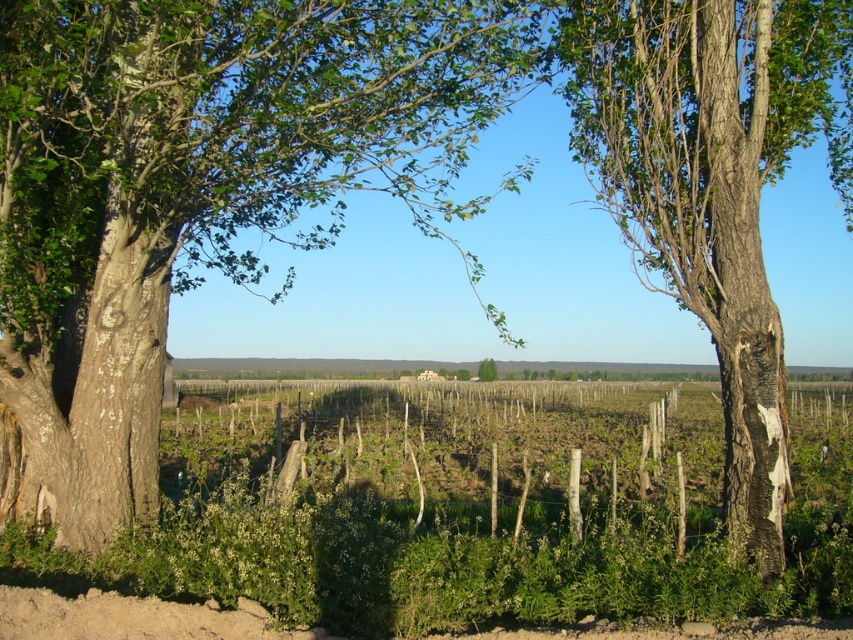
Question: Which object is the closest to the smooth bark tree at right?

Choices:
 (A) green leafy tree at center
 (B) green leafy vines at center

Answer: (B)

Question: Is the position of green leafy vines at center more distant than that of smooth bark tree at right?

Choices:
 (A) no
 (B) yes

Answer: (A)

Question: Which point is closer to the camera?

Choices:
 (A) green leafy vines at center
 (B) smooth brown tree trunk at left
 (C) green leafy tree at center

Answer: (B)

Question: Which is farther from the green leafy vines at center?

Choices:
 (A) smooth bark tree at right
 (B) smooth brown tree trunk at left
 (C) green leafy tree at center

Answer: (C)

Question: Is smooth brown tree trunk at left positioned behind smooth bark tree at right?

Choices:
 (A) no
 (B) yes

Answer: (A)

Question: Does green leafy vines at center appear on the left side of green leafy tree at center?

Choices:
 (A) no
 (B) yes

Answer: (B)